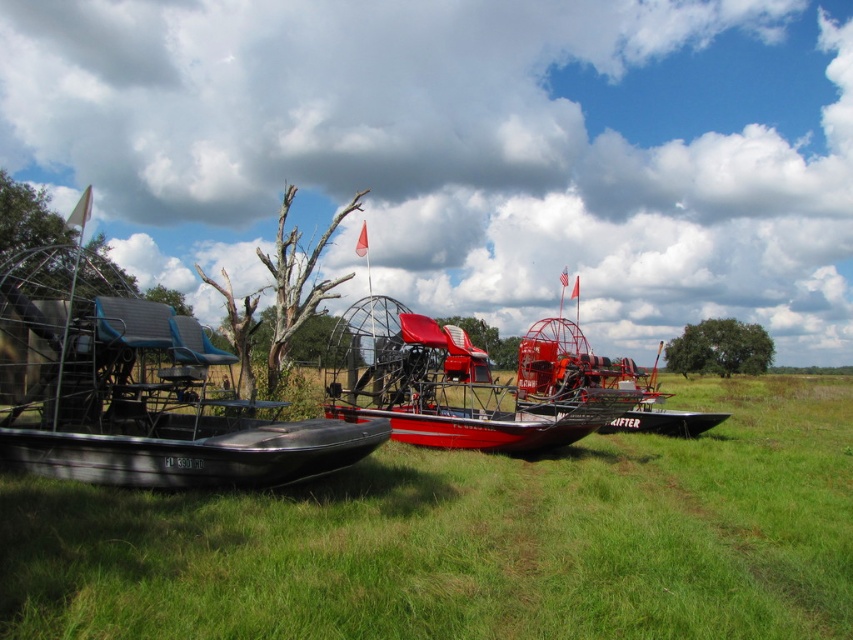
Can you confirm if green grass at lower left is thinner than black matte airboat at left?

No.

Between point (747, 429) and point (207, 445), which one is positioned in front?

Point (207, 445) is more forward.

The width and height of the screenshot is (853, 640). Describe the element at coordinates (473, 538) in the screenshot. I see `green grass at lower left` at that location.

In order to click on green grass at lower left in this screenshot , I will do `click(473, 538)`.

Which is behind, point (280, 595) or point (410, 337)?

The point (410, 337) is behind.

Which is below, green grass at lower left or red matte airboat at center?

Positioned lower is green grass at lower left.

Is point (757, 468) positioned after point (572, 387)?

No.

Where is `green grass at lower left`? This screenshot has height=640, width=853. green grass at lower left is located at coordinates (473, 538).

Can you confirm if black matte airboat at left is positioned above red matte airboat at center?

Correct, black matte airboat at left is located above red matte airboat at center.

Can you confirm if black matte airboat at left is positioned to the right of red matte airboat at center?

Incorrect, black matte airboat at left is not on the right side of red matte airboat at center.

Who is more forward, [268,480] or [387,387]?

Point [268,480] is in front.

Image resolution: width=853 pixels, height=640 pixels. I want to click on black matte airboat at left, so coord(137,390).